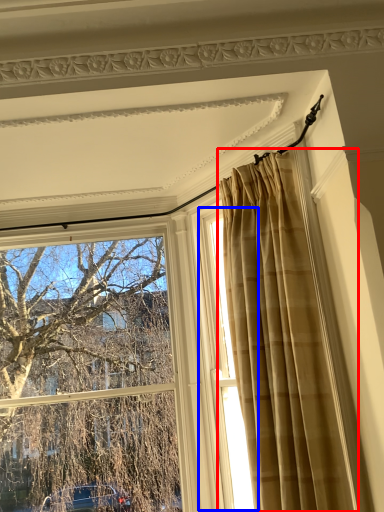
Question: Which object is closer to the camera taking this photo, curtain (highlighted by a red box) or window (highlighted by a blue box)?

Choices:
 (A) curtain
 (B) window

Answer: (A)